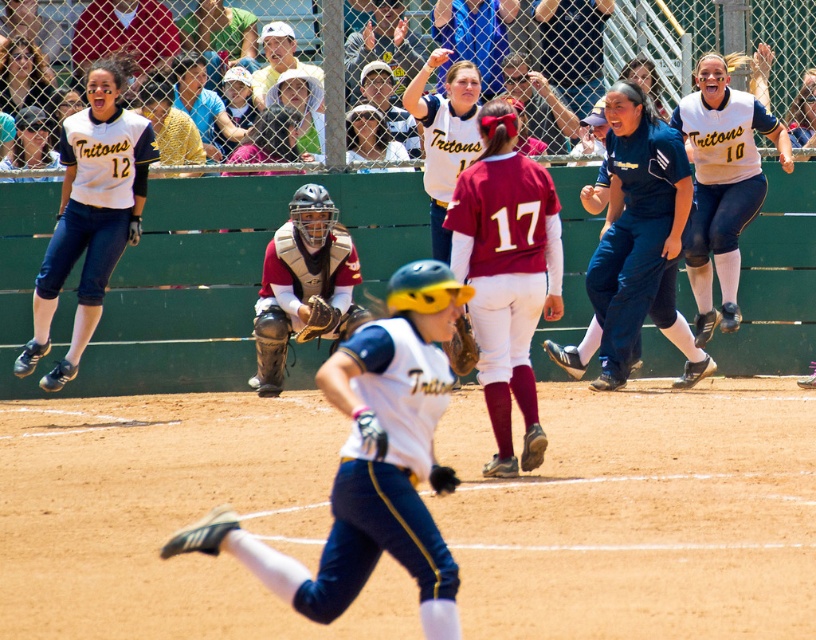
Question: Can you confirm if brown leather baseball glove at center is positioned above brown leather glove at center?

Choices:
 (A) no
 (B) yes

Answer: (A)

Question: In this image, where is maroon leather catcher at center located relative to brown leather baseball glove at center?

Choices:
 (A) left
 (B) right

Answer: (A)

Question: Can you confirm if maroon leather catcher at center is bigger than matte white helmet at upper center?

Choices:
 (A) no
 (B) yes

Answer: (B)

Question: Among these points, which one is nearest to the camera?

Choices:
 (A) (285, 346)
 (B) (20, 81)
 (C) (463, 342)
 (D) (349, 150)

Answer: (C)

Question: Among these points, which one is nearest to the camera?

Choices:
 (A) (114, 116)
 (B) (357, 406)
 (C) (460, 364)

Answer: (B)

Question: Which of the following is the farthest from the observer?

Choices:
 (A) white jersey at upper left
 (B) white matte uniform at center

Answer: (A)